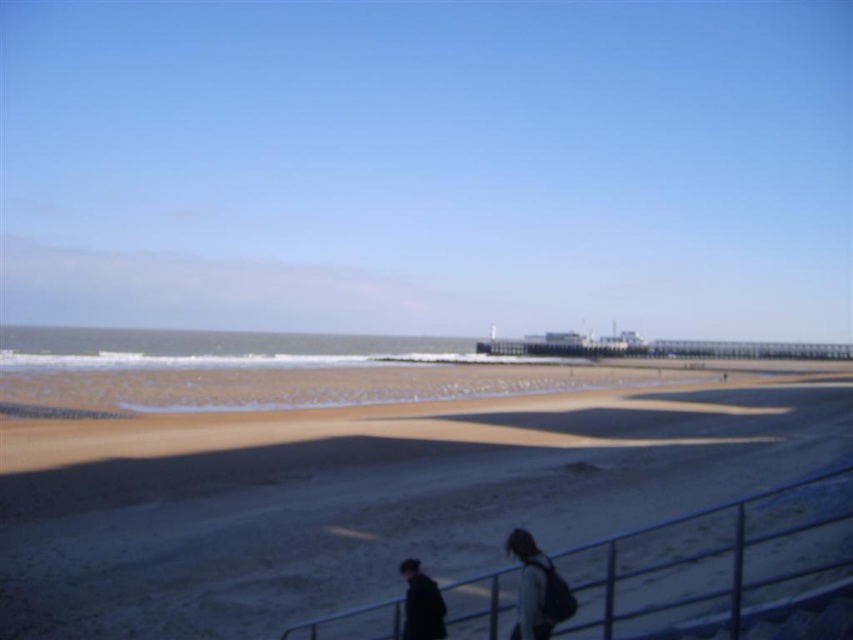
Does metallic silver railing at lower center lie in front of dark blue fabric jacket at lower center?

Yes, metallic silver railing at lower center is closer to the viewer.

Which is behind, point (769, 516) or point (415, 624)?

The point (769, 516) is behind.

You are a GUI agent. You are given a task and a screenshot of the screen. Output one action in this format:
    pyautogui.click(x=<x>, y=<y>)
    Task: Click on the metallic silver railing at lower center
    The height and width of the screenshot is (640, 853).
    Given the screenshot: What is the action you would take?
    (715, 564)

I want to click on metallic silver railing at lower center, so click(715, 564).

Is point (469, 490) closer to viewer compared to point (840, 480)?

No, it is not.

Who is more distant from viewer, (200, 477) or (563, 561)?

Positioned behind is point (200, 477).

Describe the element at coordinates (376, 502) in the screenshot. The width and height of the screenshot is (853, 640). I see `brown sandy beach at lower center` at that location.

Identify the location of brown sandy beach at lower center. (376, 502).

Who is shorter, brown sandy beach at lower center or dark blue fabric jacket at lower center?

dark blue fabric jacket at lower center is shorter.

Between brown sandy beach at lower center and dark blue fabric jacket at lower center, which one appears on the left side from the viewer's perspective?

Positioned to the left is dark blue fabric jacket at lower center.

In order to click on brown sandy beach at lower center in this screenshot , I will do `click(376, 502)`.

This screenshot has height=640, width=853. What are the coordinates of `brown sandy beach at lower center` in the screenshot? It's located at pos(376,502).